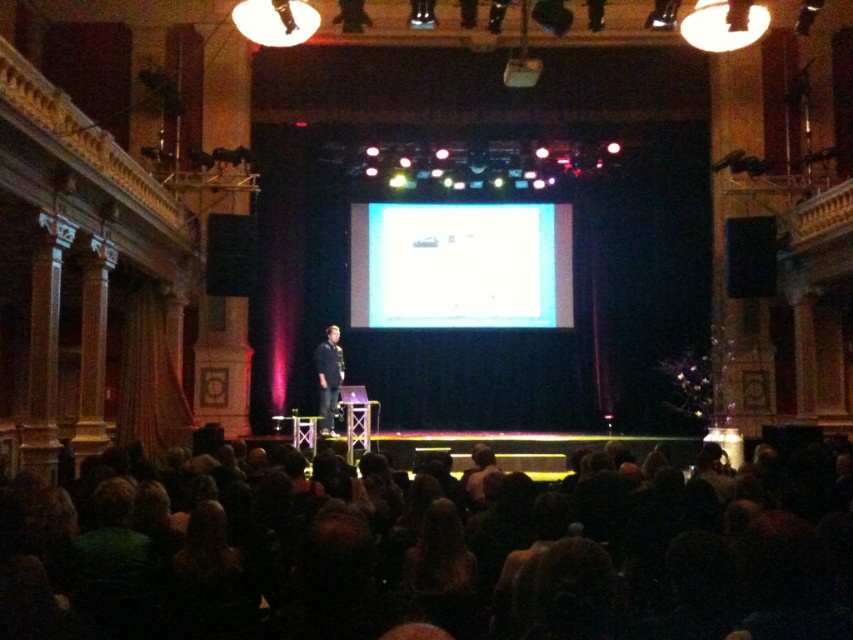
Between point (520, 248) and point (323, 392), which one is positioned behind?

Positioned behind is point (520, 248).

Is point (537, 301) behind point (328, 404)?

That is True.

Locate an element on the screen. This screenshot has height=640, width=853. white glossy screen at center is located at coordinates (460, 266).

Is point (195, 472) positioned behind point (728, 280)?

No.

This screenshot has width=853, height=640. I want to click on dark brown hair at lower center, so click(428, 548).

Does white glossy screen at center have a smaller size compared to black matte speaker at center?

Actually, white glossy screen at center might be larger than black matte speaker at center.

Between point (457, 266) and point (775, 227), which one is positioned in front?

Point (775, 227)

You are a GUI agent. You are given a task and a screenshot of the screen. Output one action in this format:
    pyautogui.click(x=<x>, y=<y>)
    Task: Click on the white glossy screen at center
    The width and height of the screenshot is (853, 640).
    Given the screenshot: What is the action you would take?
    pyautogui.click(x=460, y=266)